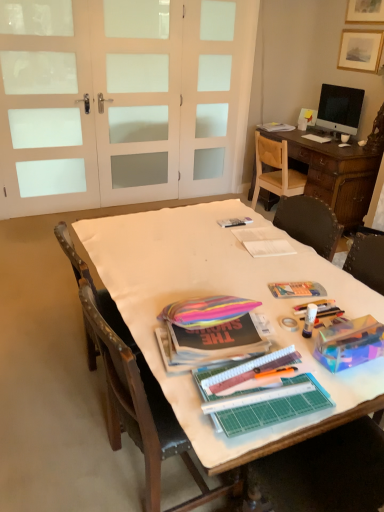
Find the location of `free space that is in between matte paper magazine at center, the second magazine positioned from the bottom, and rainbow fabric bag at center, which is counted as the third magazine, starting from the back`. free space that is in between matte paper magazine at center, the second magazine positioned from the bottom, and rainbow fabric bag at center, which is counted as the third magazine, starting from the back is located at coordinates (x=241, y=276).